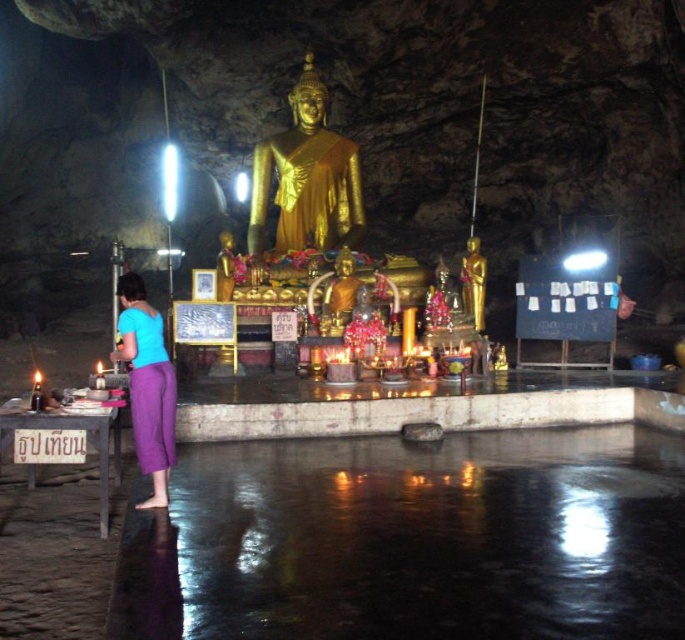
You are an interior designer planning to place a new decorative item in the cave. The item requires a space of 1.2 meters in width. You see the gold polished statue at center and the gold shiny statue at center. Which statue should you choose to place the item next to if you need more space?

The gold polished statue at center has a larger width than the gold shiny statue at center, so you should place the item next to the gold polished statue at center to have enough space.

You are standing in front of the cave altar and see the gold polished statue at center and the gold shiny statue at center. Which one is positioned to the left?

The gold polished statue at center is positioned to the left of the gold shiny statue at center.

You are standing in the cave facing the golden Buddha statue. There are two points marked in the scene. The first point is at coordinate point (471, 310) and the second is at point (342, 280). Which point is closer to you?

Point (342, 280) is closer to you because it is closer to the camera than point (471, 310).